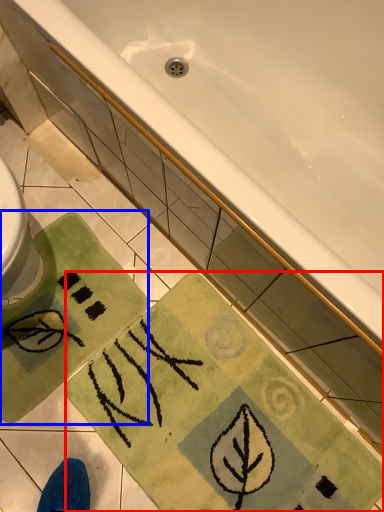
Question: Among these objects, which one is farthest to the camera, beach towel (highlighted by a red box) or beach towel (highlighted by a blue box)?

Choices:
 (A) beach towel
 (B) beach towel

Answer: (B)